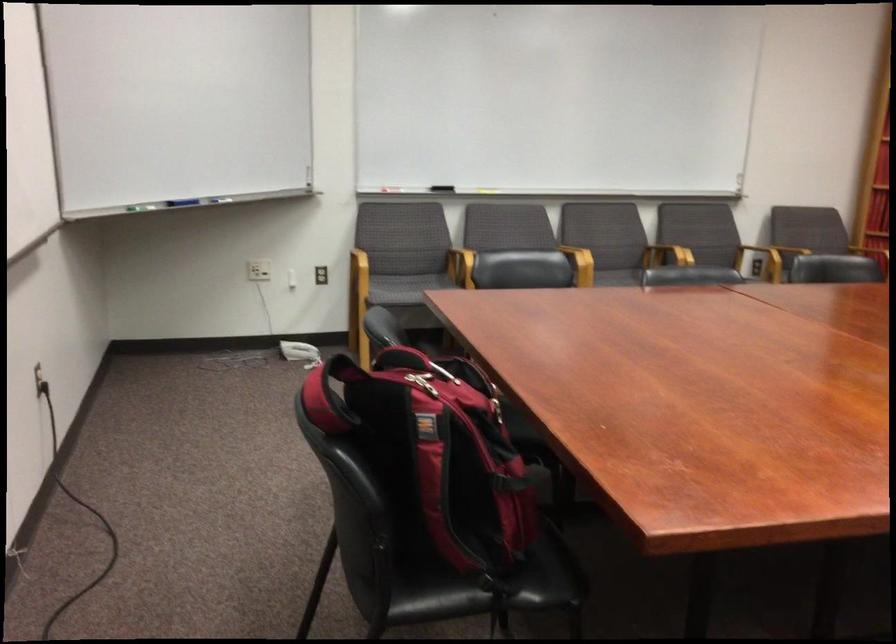
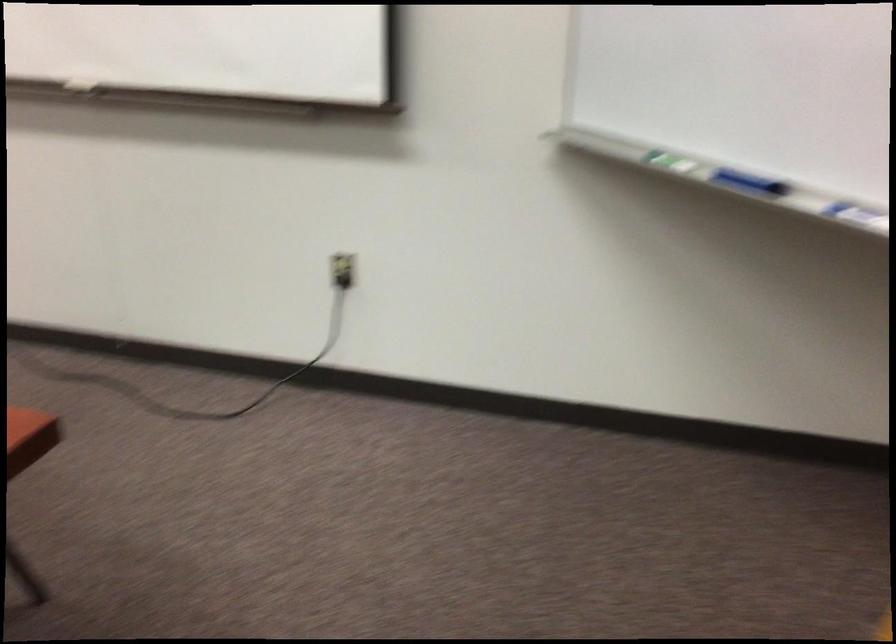
Where in the second image is the point corresponding to [110,174] from the first image?

(675, 162)